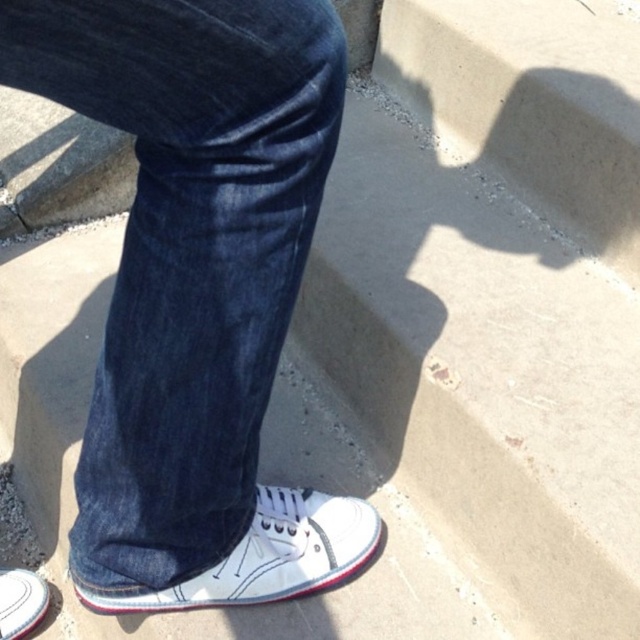
Question: Is dark blue denim jeans at center positioned behind white canvas shoe at lower left?

Choices:
 (A) no
 (B) yes

Answer: (A)

Question: Which point is farther to the camera?

Choices:
 (A) white canvas shoe at lower left
 (B) dark blue denim jeans at center

Answer: (A)

Question: Based on their relative distances, which object is nearer to the white canvas shoe at lower left?

Choices:
 (A) white canvas shoe at lower center
 (B) dark blue denim jeans at center

Answer: (A)

Question: Among these objects, which one is nearest to the camera?

Choices:
 (A) white canvas shoe at lower center
 (B) dark blue denim jeans at center
 (C) white canvas shoe at lower left

Answer: (B)

Question: Is dark blue denim jeans at center above white canvas shoe at lower center?

Choices:
 (A) yes
 (B) no

Answer: (A)

Question: Is white canvas shoe at lower center below white canvas shoe at lower left?

Choices:
 (A) yes
 (B) no

Answer: (B)